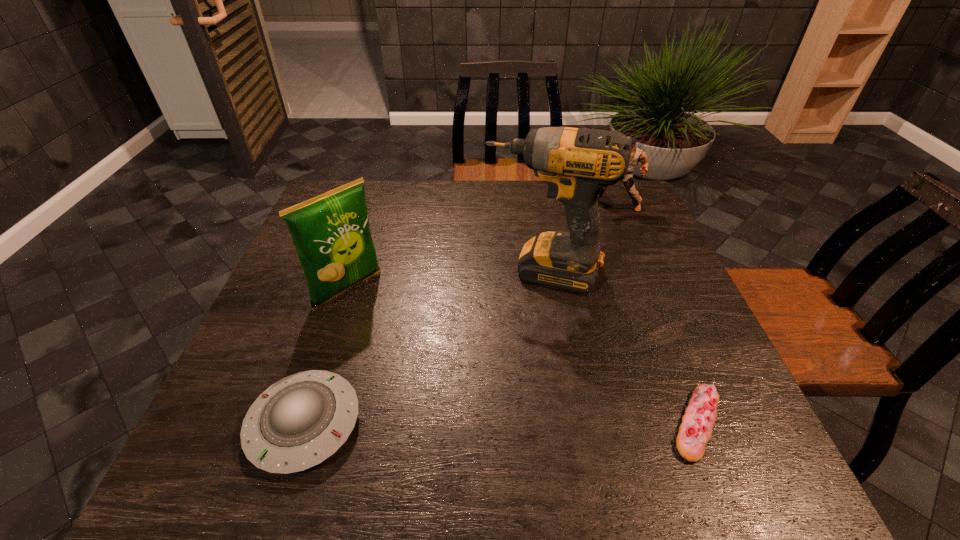
The image size is (960, 540). Identify the location of saucer. (300, 421).

This screenshot has width=960, height=540. In order to click on the shortest object in this screenshot , I will do `click(695, 431)`.

Find the location of a particular element. crisp (potato chip) is located at coordinates (331, 234).

Find the location of `the third object from left to right`. the third object from left to right is located at coordinates (576, 163).

This screenshot has height=540, width=960. Find the location of `the tallest object`. the tallest object is located at coordinates (576, 163).

Find the location of `puncher`. puncher is located at coordinates (637, 155).

Find the location of a particular element. the farthest object is located at coordinates (637, 155).

This screenshot has width=960, height=540. I want to click on vacant point located on the back of the second shortest object, so click(325, 358).

Image resolution: width=960 pixels, height=540 pixels. I want to click on free spot located 0.100m on the left of the shortest object, so click(612, 423).

Find the location of a particular element. vacant space located on the front-facing side of the crisp (potato chip) is located at coordinates (393, 329).